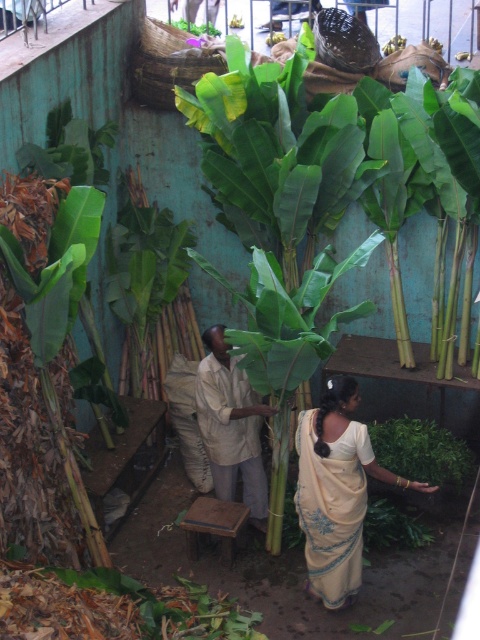
Who is positioned more to the left, green leafy banana tree at center or beige silk saree at center?

From the viewer's perspective, green leafy banana tree at center appears more on the left side.

Is green leafy banana tree at center to the left of beige silk saree at center from the viewer's perspective?

Yes, green leafy banana tree at center is to the left of beige silk saree at center.

Which is behind, point (292, 234) or point (301, 516)?

Positioned behind is point (292, 234).

Identify the location of green leafy banana tree at center. (279, 218).

Who is shorter, beige silk saree at center or wooden stool at center?

wooden stool at center

Is beige silk saree at center wider than wooden stool at center?

Yes.

The width and height of the screenshot is (480, 640). I want to click on beige silk saree at center, so click(336, 492).

Does point (393, 476) come behind point (414, 468)?

No, (393, 476) is closer to viewer.

Consider the image. Is beige silk saree at center shorter than green leafy plant at lower right?

Incorrect, beige silk saree at center's height does not fall short of green leafy plant at lower right's.

Identify the location of beige silk saree at center. (336, 492).